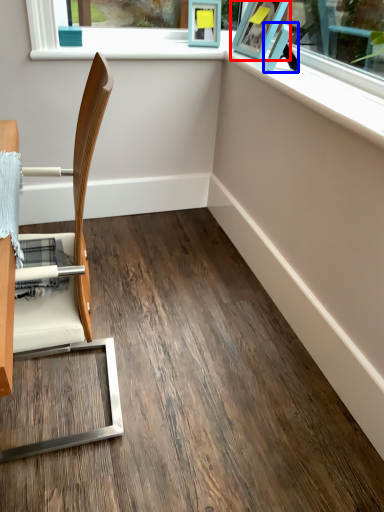
Question: Which of the following is the farthest to the observer, picture frame (highlighted by a red box) or picture frame (highlighted by a blue box)?

Choices:
 (A) picture frame
 (B) picture frame

Answer: (A)